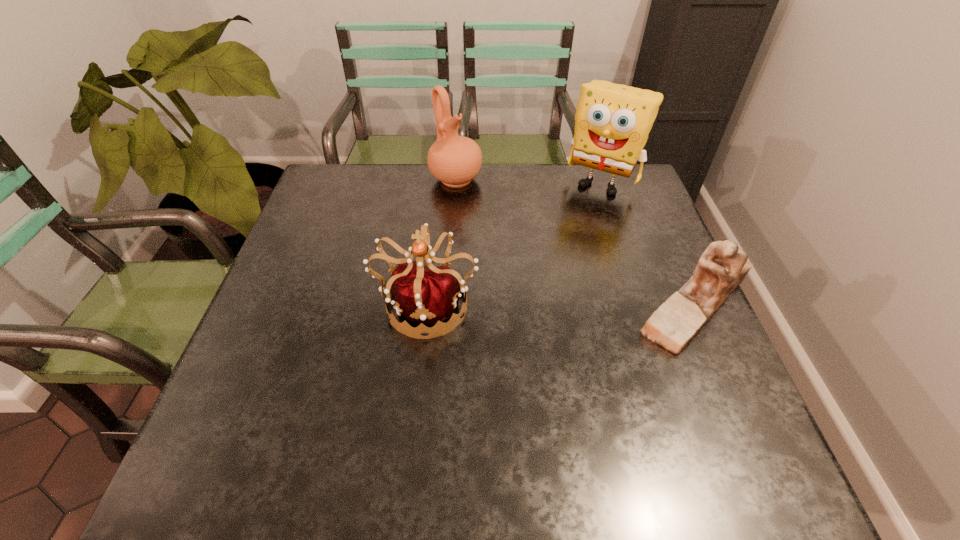
Where is `blank space located on the face of the sponge`? The image size is (960, 540). blank space located on the face of the sponge is located at coordinates (564, 238).

The image size is (960, 540). In order to click on vacant space positioned 0.330m on the spout of the pottery in this screenshot , I will do `click(535, 256)`.

This screenshot has width=960, height=540. Find the location of `free spot located on the spout of the pottery`. free spot located on the spout of the pottery is located at coordinates (481, 204).

You are a GUI agent. You are given a task and a screenshot of the screen. Output one action in this format:
    pyautogui.click(x=<x>, y=<y>)
    Task: Click on the free space located on the spout of the pottery
    This screenshot has height=540, width=960.
    Given the screenshot: What is the action you would take?
    523,245

You are a GUI agent. You are given a task and a screenshot of the screen. Output one action in this format:
    pyautogui.click(x=<x>, y=<y>)
    Task: Click on the sponge that is at the far edge
    
    Given the screenshot: What is the action you would take?
    pyautogui.click(x=612, y=122)

In order to click on pottery that is at the far edge in this screenshot , I will do coord(455,160).

I want to click on figurine located in the right edge section of the desktop, so click(723, 266).

This screenshot has width=960, height=540. Find the location of `sponge that is at the right edge`. sponge that is at the right edge is located at coordinates (612, 122).

Identify the location of object at the far right corner. (612, 122).

This screenshot has width=960, height=540. Identify the location of free spot at the far edge of the desktop. (476, 179).